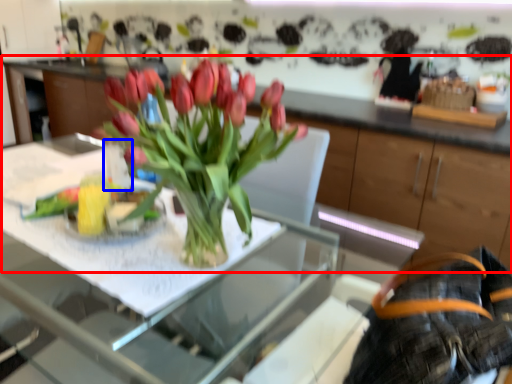
Question: Among these objects, which one is nearest to the camera, cabinetry (highlighted by a red box) or vase (highlighted by a blue box)?

Choices:
 (A) cabinetry
 (B) vase

Answer: (A)